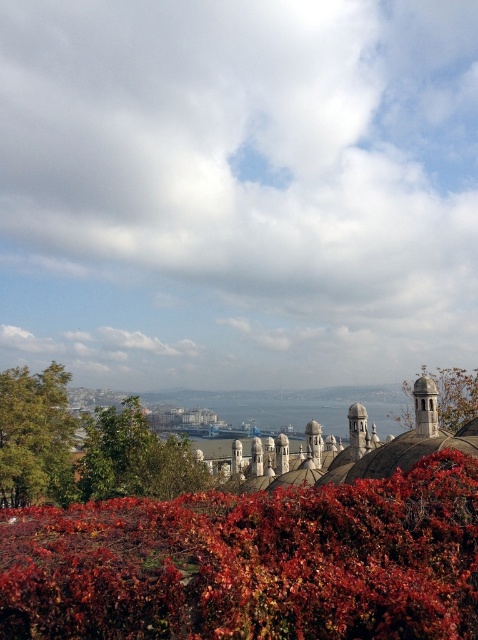
You are an urban planner analyzing this cityscape. You notice two green leafy trees in the scene. Which tree, the green leafy tree at upper left or the green leafy tree at lower left, would require more space for maintenance due to its size?

The green leafy tree at upper left requires more space for maintenance because it is larger in size than the green leafy tree at lower left.

You are standing at the center of the cityscape image. Which direction should you look to see the green leafy tree at lower left?

The green leafy tree at lower left is located at point [134,458], which is towards the lower left direction from your current position at the center of the image.

You are standing in the city park and see the green leafy tree at lower left and the green matte dome at upper center. Which object is closer to the ground?

The green leafy tree at lower left is closer to the ground because it is positioned below the green matte dome at upper center.